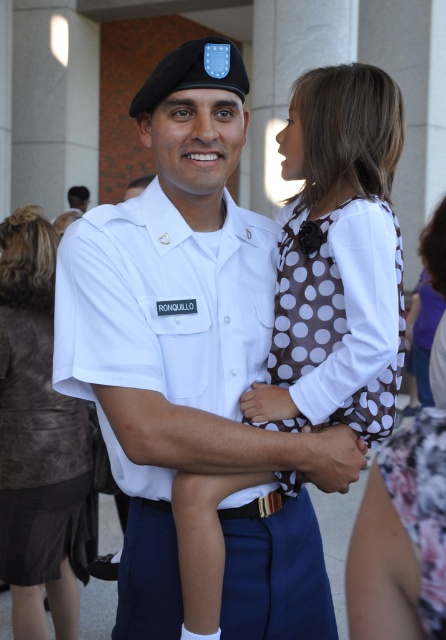
Does white uniform at center have a smaller size compared to brown dotted fabric at upper center?

No, white uniform at center is not smaller than brown dotted fabric at upper center.

Can you confirm if white uniform at center is positioned to the right of brown dotted fabric at upper center?

Incorrect, white uniform at center is not on the right side of brown dotted fabric at upper center.

What do you see at coordinates (161, 355) in the screenshot?
I see `white uniform at center` at bounding box center [161, 355].

Image resolution: width=446 pixels, height=640 pixels. In order to click on white uniform at center in this screenshot , I will do `click(161, 355)`.

Who is more forward, [293,308] or [66,429]?

Point [293,308] is in front.

Can you confirm if brown dotted dress at center is shorter than brown suede jacket at upper left?

Yes.

Image resolution: width=446 pixels, height=640 pixels. In order to click on brown dotted dress at center in this screenshot , I will do `click(337, 259)`.

The image size is (446, 640). In order to click on brown dotted dress at center in this screenshot , I will do (337, 259).

Can you confirm if white uniform at center is taller than brown dotted dress at center?

Incorrect, white uniform at center's height is not larger of brown dotted dress at center's.

Who is more distant from viewer, (x=243, y=449) or (x=352, y=88)?

Positioned behind is point (x=352, y=88).

Who is more forward, (135, 593) or (393, 104)?

Point (135, 593) is more forward.

Find the location of a particular element. The width and height of the screenshot is (446, 640). white uniform at center is located at coordinates (161, 355).